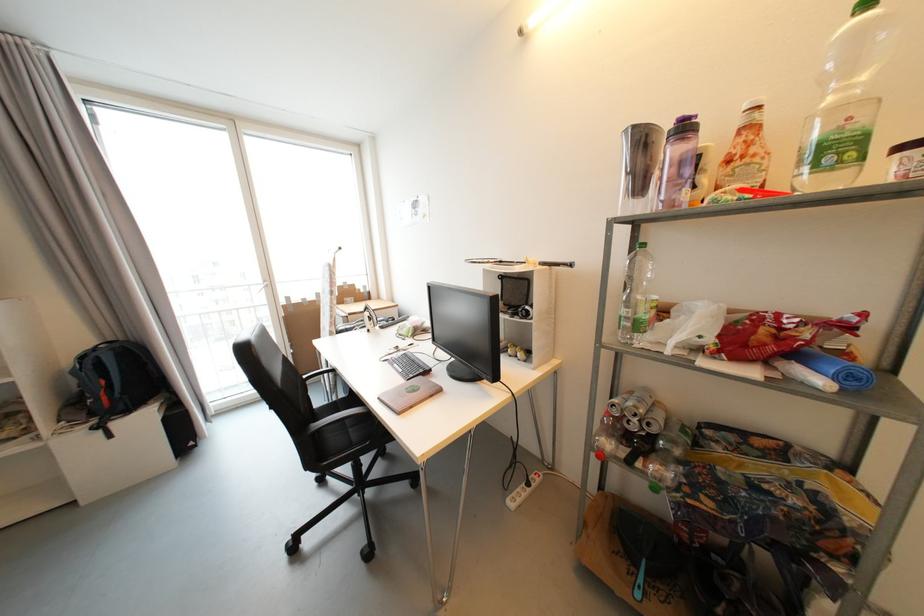
This screenshot has height=616, width=924. What are the coordinates of `black backpack` in the screenshot? It's located at (116, 379).